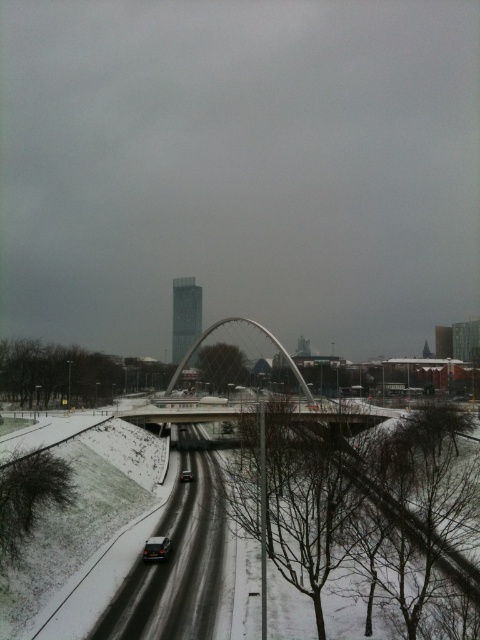
You are a delivery person needing to cross the road to reach the bridge. Based on the scene, which object is closer to you, the black asphalt road at lower center or the concrete bridge at center?

The black asphalt road at lower center is closer to the viewer than the concrete bridge at center, so you should approach the road first before reaching the bridge.

You are a delivery person who needs to cross the road to reach the glassy steel bridge at center. Given that the black asphalt road at lower center is in your path, can you safely navigate around it to reach the bridge?

The black asphalt road at lower center is positioned on the left side of the glassy steel bridge at center. Since the road is to the left of the bridge, you can safely navigate around it by moving to the right side of the road to reach the bridge.